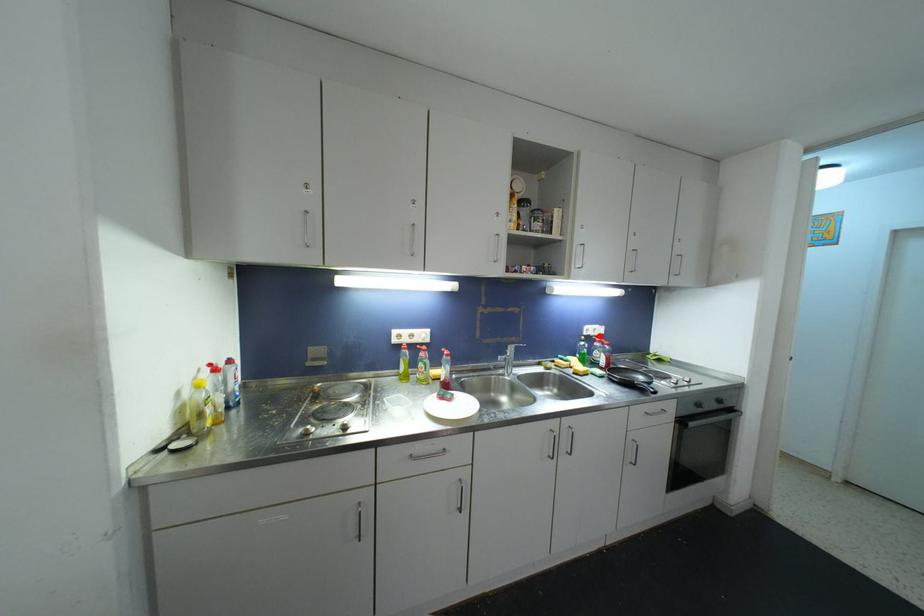
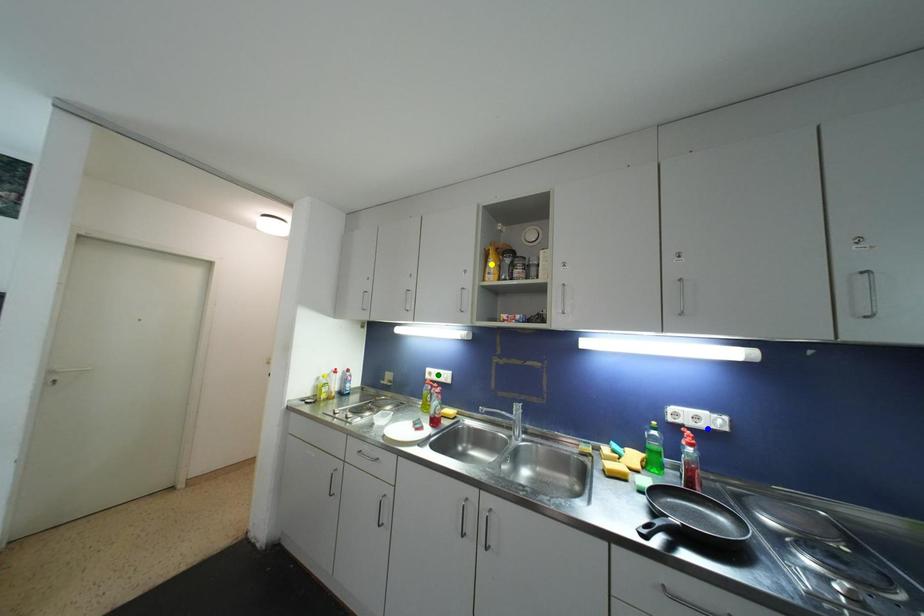
Question: I am providing you with two images of the same scene from different viewpoints. A red point is marked on the first image. You are given multiple points on the second image. In image 2, which mark is for the same physical point as the one in image 1?

Choices:
 (A) yellow point
 (B) blue point
 (C) green point

Answer: (B)